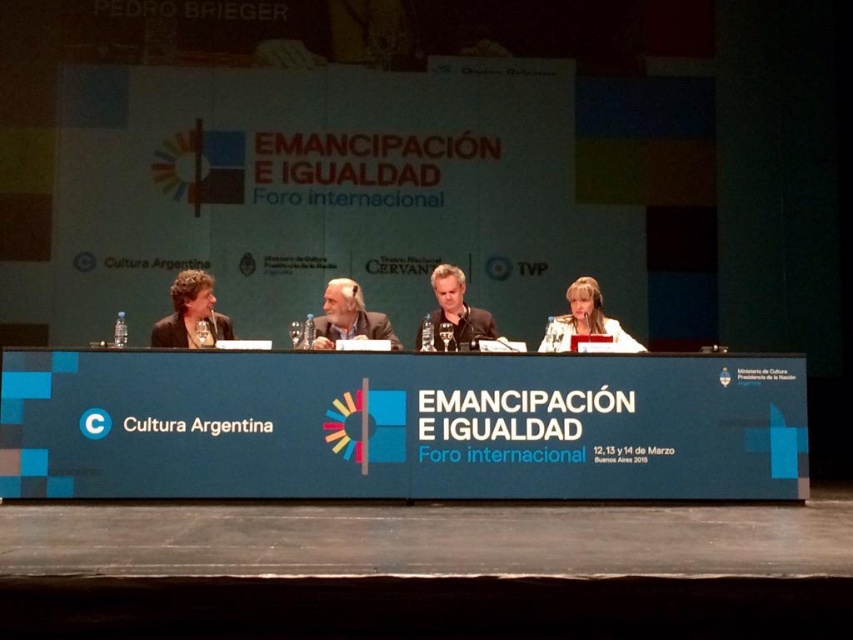
You are an event organizer arranging name tags for the panelists. You have two points marked on the stage where the name tags should be placed. The first point is at coordinates point (287, 458) and the second is at point (207, 284). Which point is closer to the audience?

Point (287, 458) is in front of point (207, 284), so it is closer to the audience.